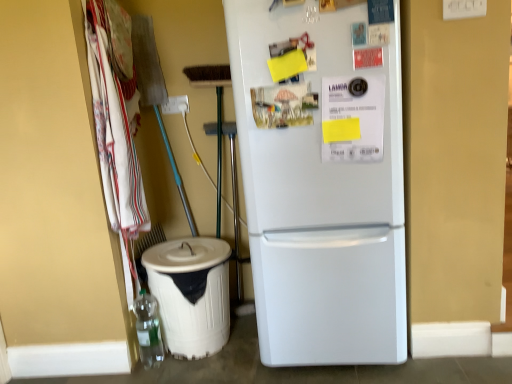
Question: From the image's perspective, is white cotton towels at left under white matte refrigerator at center?

Choices:
 (A) yes
 (B) no

Answer: (B)

Question: Is white cotton towels at left turned away from white matte refrigerator at center?

Choices:
 (A) yes
 (B) no

Answer: (B)

Question: Does white cotton towels at left have a smaller size compared to white matte refrigerator at center?

Choices:
 (A) no
 (B) yes

Answer: (B)

Question: Is white cotton towels at left positioned beyond the bounds of white matte refrigerator at center?

Choices:
 (A) no
 (B) yes

Answer: (B)

Question: Considering the relative positions of white cotton towels at left and white matte refrigerator at center in the image provided, is white cotton towels at left to the left of white matte refrigerator at center from the viewer's perspective?

Choices:
 (A) yes
 (B) no

Answer: (A)

Question: Is white matte refrigerator at center surrounded by white cotton towels at left?

Choices:
 (A) yes
 (B) no

Answer: (B)

Question: Does white cotton towels at left have a lesser width compared to white plastic recycling bin at lower left?

Choices:
 (A) yes
 (B) no

Answer: (A)

Question: From a real-world perspective, is white cotton towels at left below white plastic recycling bin at lower left?

Choices:
 (A) yes
 (B) no

Answer: (B)

Question: Is white cotton towels at left closer to camera compared to white plastic recycling bin at lower left?

Choices:
 (A) yes
 (B) no

Answer: (A)

Question: Is white cotton towels at left facing away from white plastic recycling bin at lower left?

Choices:
 (A) no
 (B) yes

Answer: (A)

Question: Is white cotton towels at left at the left side of white plastic recycling bin at lower left?

Choices:
 (A) yes
 (B) no

Answer: (A)

Question: From the image's perspective, is white cotton towels at left located beneath white plastic recycling bin at lower left?

Choices:
 (A) yes
 (B) no

Answer: (B)

Question: Is white plastic recycling bin at lower left shorter than white matte refrigerator at center?

Choices:
 (A) yes
 (B) no

Answer: (A)